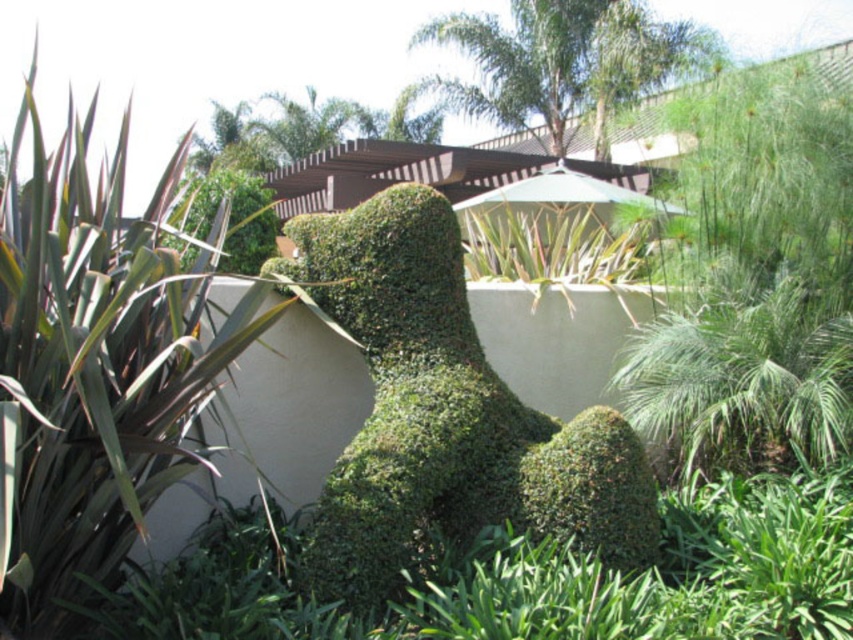
Who is lower down, green leafy bush at left or green leafy bush at center?

Positioned lower is green leafy bush at center.

The height and width of the screenshot is (640, 853). In order to click on green leafy bush at left in this screenshot , I will do `click(99, 360)`.

Find the location of a particular element. green leafy bush at left is located at coordinates (99, 360).